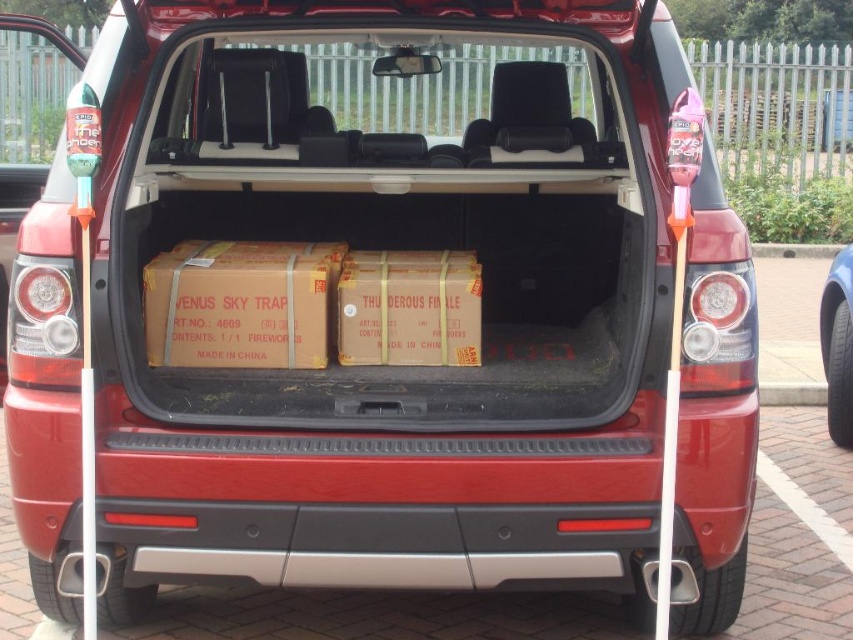
Consider the image. Is the position of brown cardboard box at center less distant than that of black rubber tire at lower right?

Yes, it is.

Who is more forward, (317, 294) or (840, 429)?

Point (317, 294)

Identify the location of brown cardboard box at center. (242, 305).

This screenshot has width=853, height=640. In order to click on brown cardboard box at center in this screenshot , I will do click(x=242, y=305).